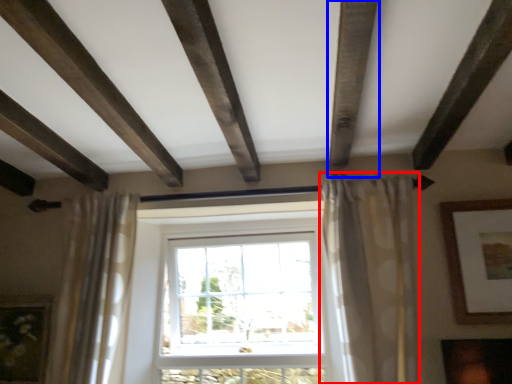
Question: Among these objects, which one is nearest to the camera, curtain (highlighted by a red box) or plank (highlighted by a blue box)?

Choices:
 (A) curtain
 (B) plank

Answer: (B)